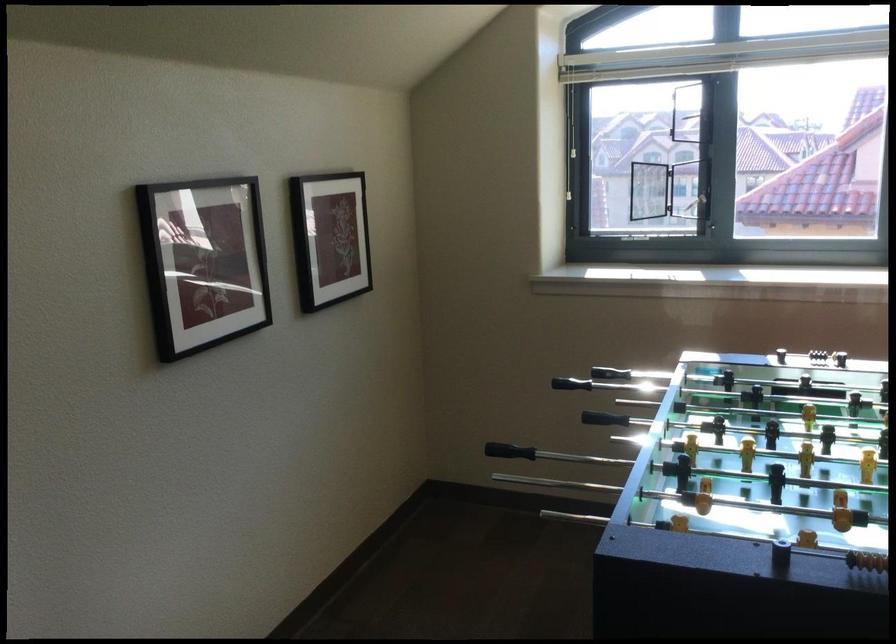
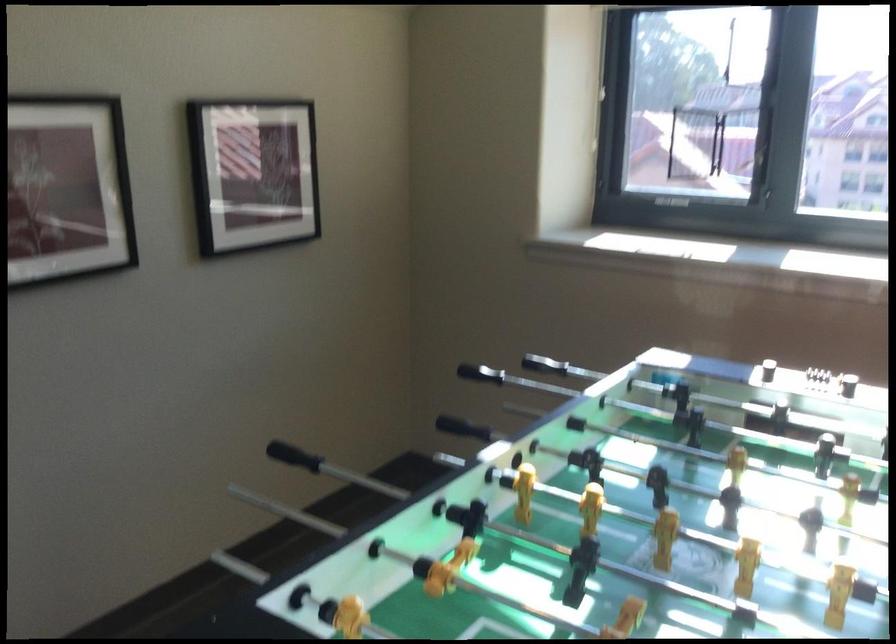
Find the pixel in the second image that matches (558,371) in the first image.

(544, 365)